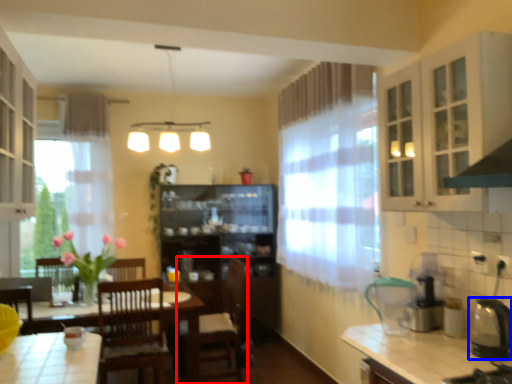
Question: Which of the following is the farthest to the observer, chair (highlighted by a red box) or appliance (highlighted by a blue box)?

Choices:
 (A) chair
 (B) appliance

Answer: (A)